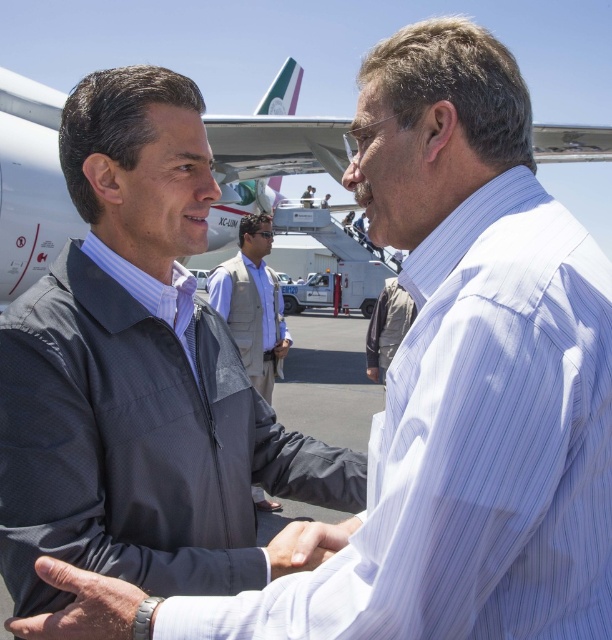
You are a photographer adjusting your camera settings to capture the handshake between the two men at the airport. You want to ensure the smooth skin hand at center is in focus. According to the coordinates provided, where should you aim your focus point?

The smooth skin hand at center is located at coordinates point [81,605], so you should aim your focus point there to ensure it is in focus.

You are a security guard at the airport and need to verify the height of the light brown vest at center and the smooth skin hand at center. Which object is taller?

The light brown vest at center is taller than the smooth skin hand at center.